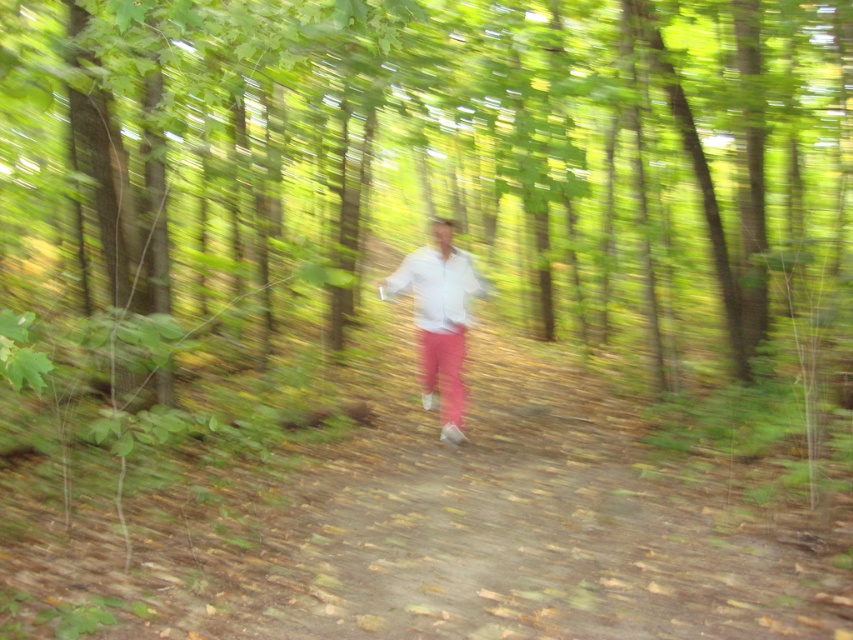
Between green leafy tree at center and white matte shirt at center, which one is positioned lower?

white matte shirt at center

Can you confirm if green leafy tree at center is bigger than white matte shirt at center?

Yes.

Identify the location of green leafy tree at center. The width and height of the screenshot is (853, 640). (445, 150).